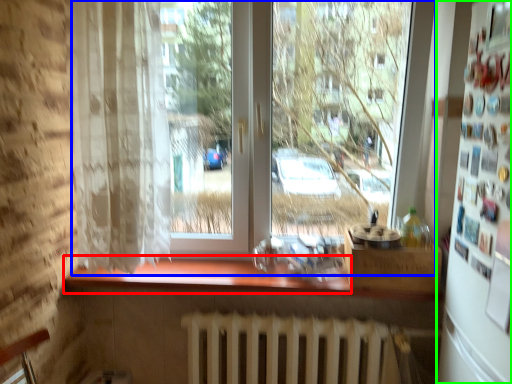
Question: Which object is positioned closest to counter top (highlighted by a red box)? Select from window (highlighted by a blue box) and fridge (highlighted by a green box).

Choices:
 (A) window
 (B) fridge

Answer: (A)